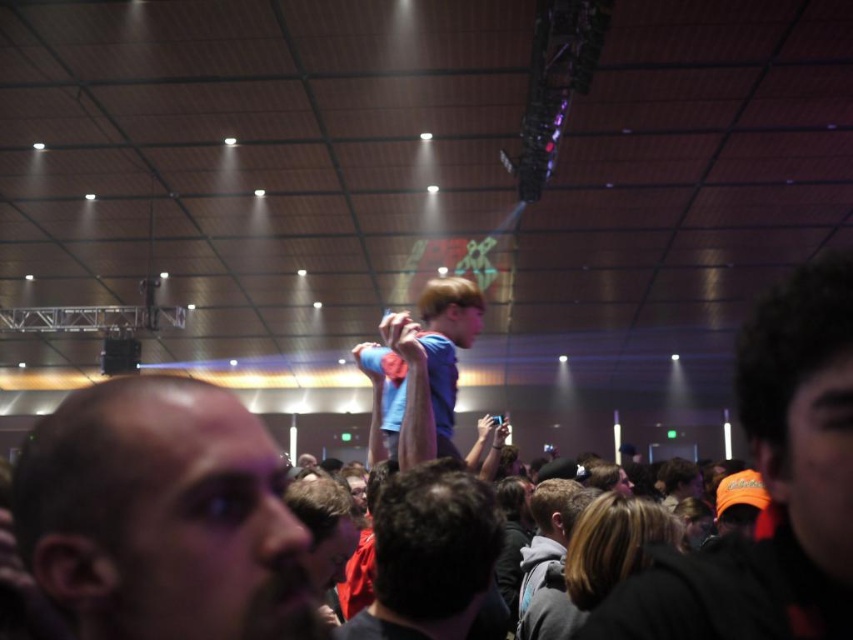
Does bald head at center appear over orange knit cap at center?

Incorrect, bald head at center is not positioned above orange knit cap at center.

Is bald head at center wider than orange knit cap at center?

Correct, the width of bald head at center exceeds that of orange knit cap at center.

Between point (281, 616) and point (805, 353), which one is positioned in front?

Point (281, 616)

You are a GUI agent. You are given a task and a screenshot of the screen. Output one action in this format:
    pyautogui.click(x=<x>, y=<y>)
    Task: Click on the bald head at center
    This screenshot has height=640, width=853.
    Given the screenshot: What is the action you would take?
    pyautogui.click(x=161, y=515)

Between dark blue shirt at center and blue matte shirt at center, which one has less height?

dark blue shirt at center is shorter.

Who is higher up, dark blue shirt at center or blue matte shirt at center?

Positioned higher is blue matte shirt at center.

Locate an element on the screen. This screenshot has height=640, width=853. dark blue shirt at center is located at coordinates (433, 560).

Where is `dark blue shirt at center`? dark blue shirt at center is located at coordinates (433, 560).

Between point (722, 556) and point (460, 592), which one is positioned behind?

Point (460, 592)

Does orange knit cap at center lie in front of dark blue shirt at center?

That is True.

The image size is (853, 640). Describe the element at coordinates (770, 486) in the screenshot. I see `orange knit cap at center` at that location.

The width and height of the screenshot is (853, 640). Find the location of `orange knit cap at center`. orange knit cap at center is located at coordinates (770, 486).